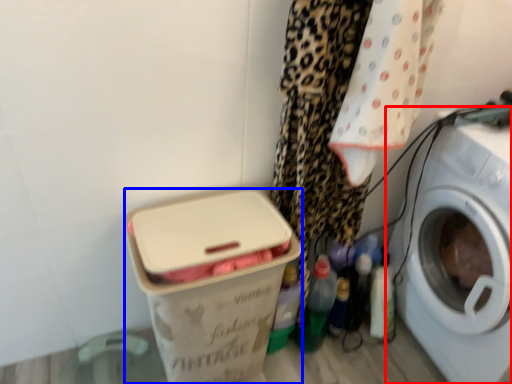
Question: Which of the following is the closest to the observer, washing machine (highlighted by a red box) or box (highlighted by a blue box)?

Choices:
 (A) washing machine
 (B) box

Answer: (A)